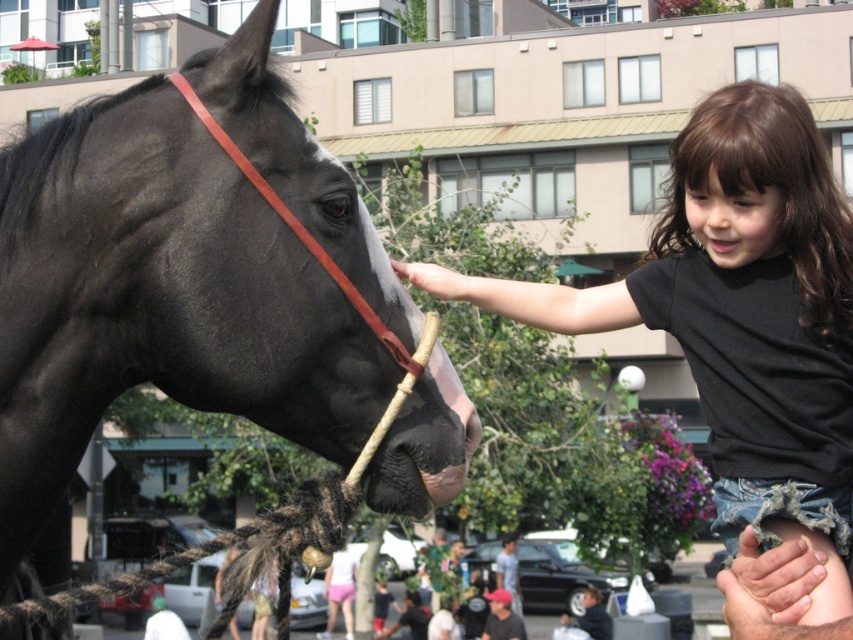
Is black glossy horse at left bigger than dark gray baseball cap at lower center?

Yes.

I want to click on black glossy horse at left, so [x=183, y=276].

The width and height of the screenshot is (853, 640). Find the location of `black glossy horse at left`. black glossy horse at left is located at coordinates (183, 276).

Does black t-shirt at upper right have a larger size compared to gray fabric shirt at lower center?

Indeed, black t-shirt at upper right has a larger size compared to gray fabric shirt at lower center.

What are the coordinates of `black t-shirt at upper right` in the screenshot? It's located at (738, 314).

Between black glossy horse at left and black t-shirt at upper right, which one is positioned higher?

black t-shirt at upper right is above.

Does point (274, 285) lie in front of point (821, 355)?

That is True.

The image size is (853, 640). What do you see at coordinates (183, 276) in the screenshot?
I see `black glossy horse at left` at bounding box center [183, 276].

You are a GUI agent. You are given a task and a screenshot of the screen. Output one action in this format:
    pyautogui.click(x=<x>, y=<y>)
    Task: Click on the black glossy horse at left
    The width and height of the screenshot is (853, 640).
    Given the screenshot: What is the action you would take?
    pyautogui.click(x=183, y=276)